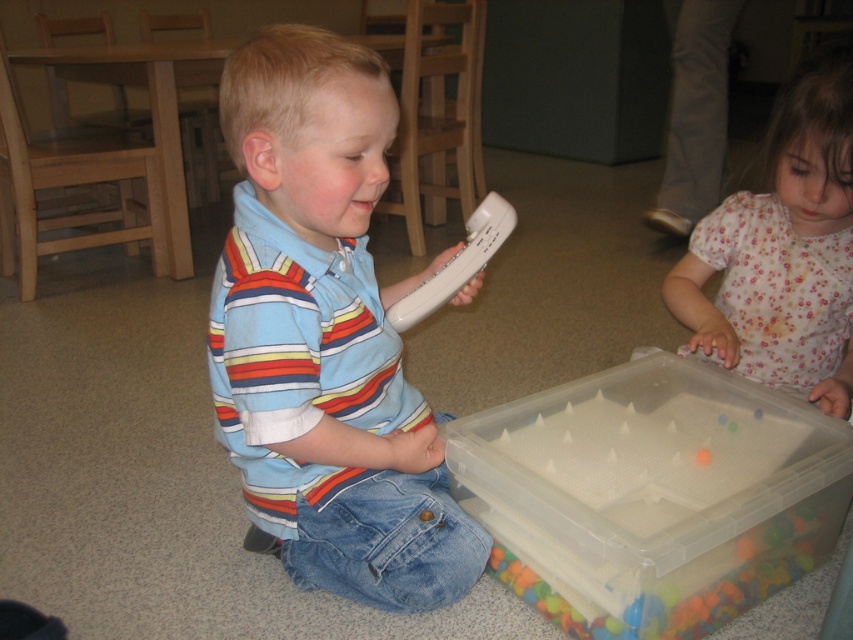
Question: Is matte striped shirt at center smaller than floral cotton shirt at lower right?

Choices:
 (A) no
 (B) yes

Answer: (A)

Question: From the image, what is the correct spatial relationship of matte striped shirt at center in relation to white plastic remote at center?

Choices:
 (A) right
 (B) left

Answer: (B)

Question: Among these objects, which one is nearest to the camera?

Choices:
 (A) clear plastic container at lower right
 (B) floral cotton shirt at lower right
 (C) matte striped shirt at center

Answer: (C)

Question: Which object is positioned closest to the floral cotton shirt at lower right?

Choices:
 (A) white plastic remote at center
 (B) matte striped shirt at center

Answer: (A)

Question: Which of the following is the farthest from the observer?

Choices:
 (A) clear plastic container at lower right
 (B) white plastic remote at center

Answer: (B)

Question: Is the position of floral cotton shirt at lower right less distant than that of white plastic remote at center?

Choices:
 (A) no
 (B) yes

Answer: (B)